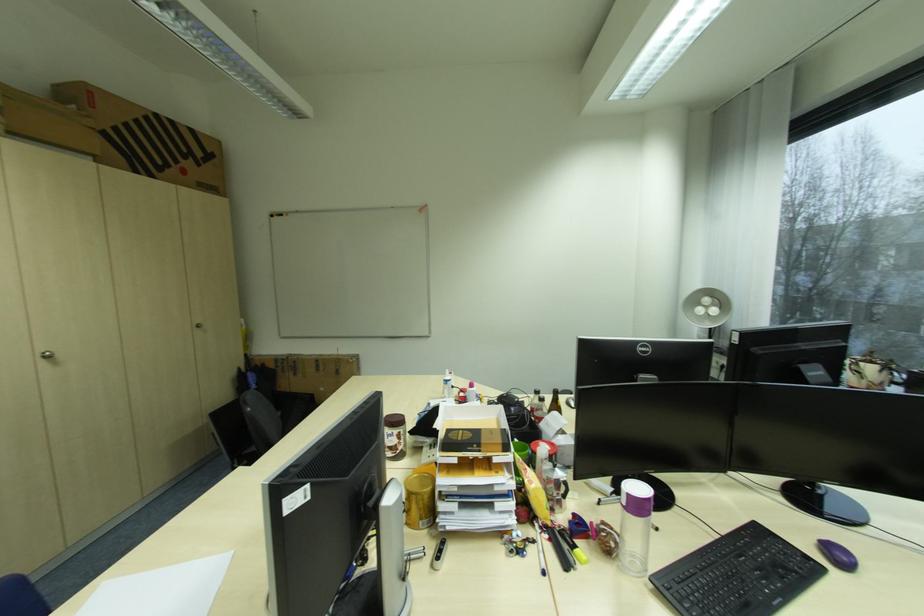
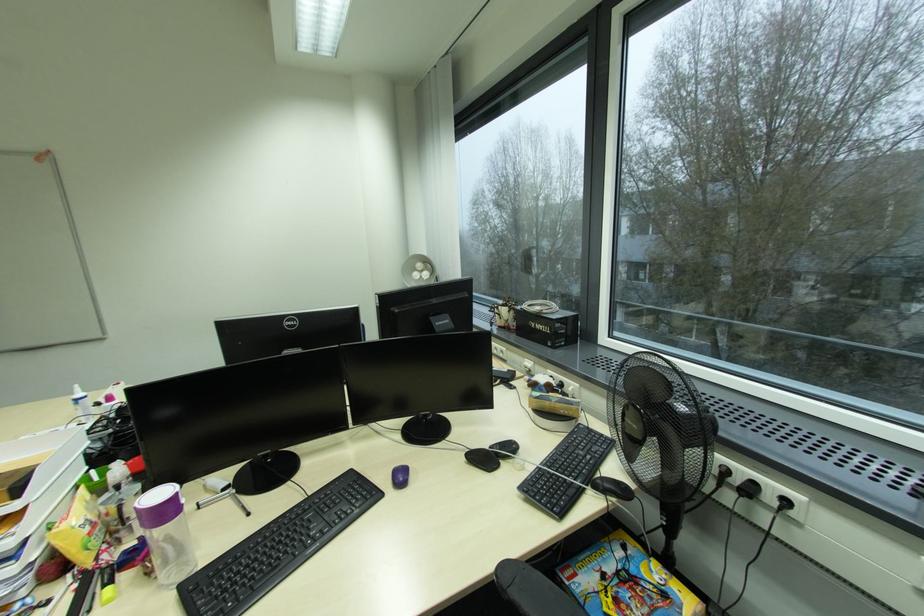
The point at (x=847, y=561) is marked in the first image. Where is the corresponding point in the second image?

(405, 483)